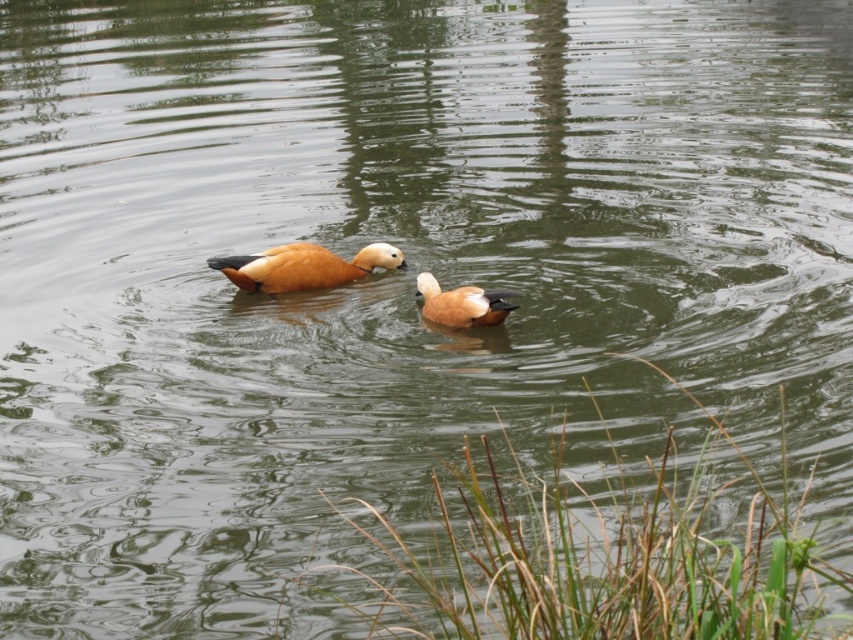
Is brown glossy duck at center thinner than brown fluffy duck at center?

In fact, brown glossy duck at center might be wider than brown fluffy duck at center.

Who is more distant from viewer, (216, 259) or (434, 289)?

Point (216, 259)

In order to click on brown glossy duck at center in this screenshot , I will do `click(303, 266)`.